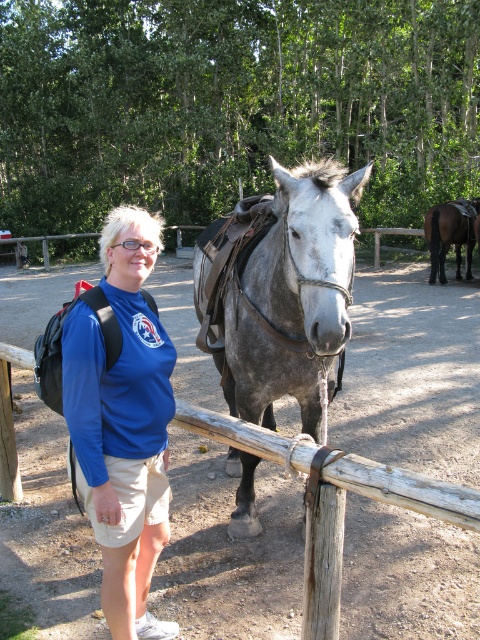
Question: Where is blue fabric shirt at center located in relation to wooden post at center in the image?

Choices:
 (A) right
 (B) left

Answer: (B)

Question: Which point appears closest to the camera in this image?

Choices:
 (A) (140, 282)
 (B) (4, 356)

Answer: (A)

Question: Is the position of blue fabric shirt at center less distant than that of shiny dark brown horse at center?

Choices:
 (A) no
 (B) yes

Answer: (B)

Question: Is wooden post at center above shiny dark brown horse at center?

Choices:
 (A) yes
 (B) no

Answer: (B)

Question: Considering the real-world distances, which object is farthest from the wooden post at center?

Choices:
 (A) shiny dark brown horse at center
 (B) blue fabric shirt at center

Answer: (A)

Question: Which of these objects is positioned farthest from the shiny dark brown horse at center?

Choices:
 (A) blue fabric shirt at center
 (B) gray matte/suede horse at center

Answer: (A)